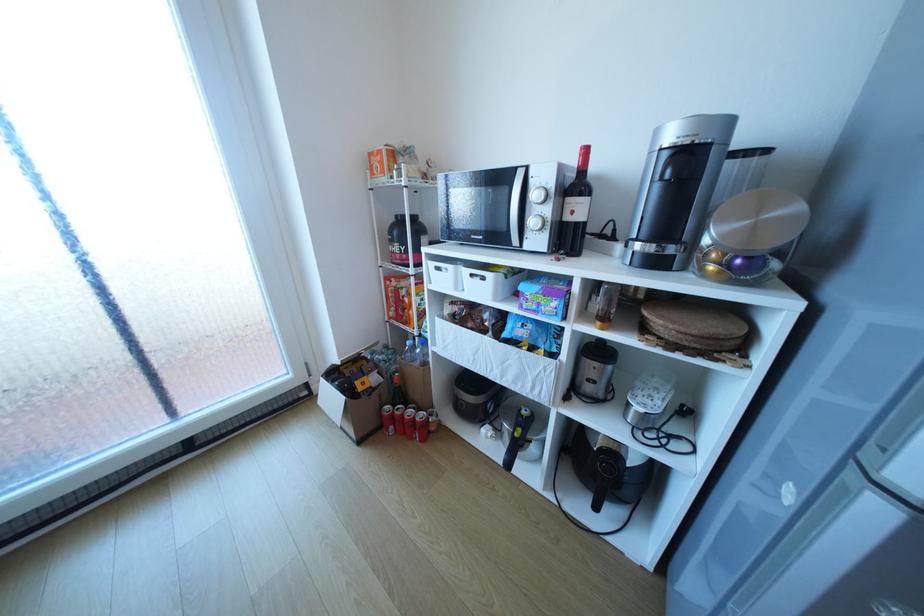
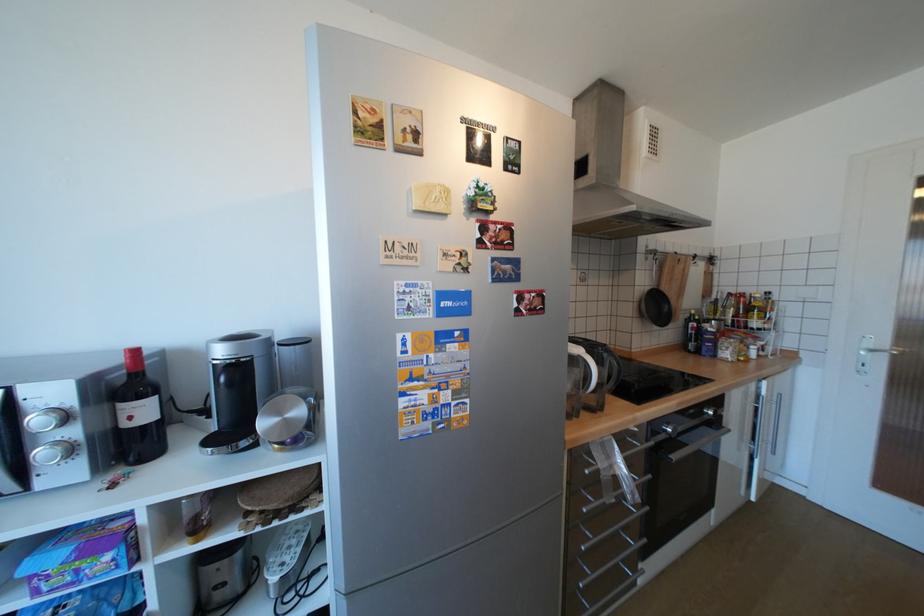
Locate, in the second image, the point that corresponds to pixel 720 267 in the first image.

(286, 446)